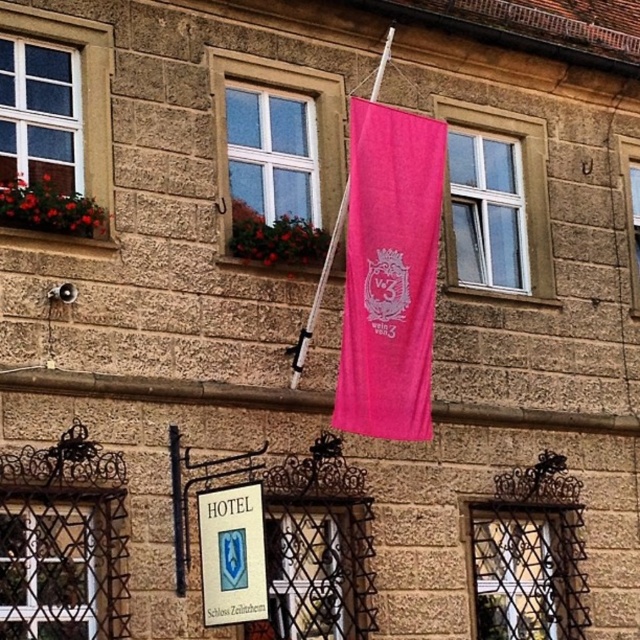
Which is below, metallic wire mesh at lower right or matte glass window at center?

metallic wire mesh at lower right

Is metallic wire mesh at lower right above matte glass window at center?

No, metallic wire mesh at lower right is not above matte glass window at center.

Is point (497, 616) more distant than point (227, 228)?

Yes, it is.

The image size is (640, 640). What are the coordinates of `metallic wire mesh at lower right` in the screenshot? It's located at (528, 570).

Can you confirm if pink fabric flag at upper center is positioned to the left of metallic wire mesh at lower left?

No, pink fabric flag at upper center is not to the left of metallic wire mesh at lower left.

Is pink fabric flag at upper center to the right of metallic wire mesh at lower left from the viewer's perspective?

Yes, pink fabric flag at upper center is to the right of metallic wire mesh at lower left.

Is point (371, 413) behind point (60, 516)?

Yes, it is.

Where is `pink fabric flag at upper center`? pink fabric flag at upper center is located at coordinates (388, 273).

Consider the image. Who is lower down, pink fabric flag at upper center or matte white window at upper left?

pink fabric flag at upper center is lower down.

Which is behind, point (436, 246) or point (68, 22)?

Positioned behind is point (68, 22).

This screenshot has height=640, width=640. I want to click on pink fabric flag at upper center, so click(388, 273).

Identify the location of pink fabric flag at upper center. Image resolution: width=640 pixels, height=640 pixels. (388, 273).